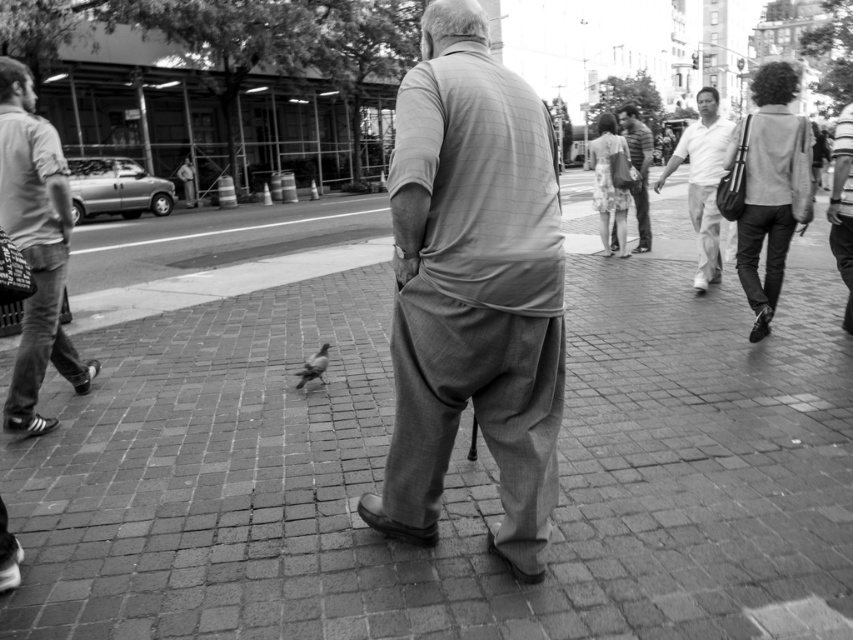
Question: Which is farther from the smooth gray pants at right?

Choices:
 (A) light gray cotton pants at center
 (B) brick pavement at center

Answer: (A)

Question: Which of the following is the closest to the observer?

Choices:
 (A) (318, 369)
 (B) (426, 188)
 (C) (32, 356)
 (D) (701, 275)

Answer: (B)

Question: Which point is farther to the camera?

Choices:
 (A) light gray cotton pants at center
 (B) white cotton shirt at upper right
 (C) light gray jeans at left

Answer: (B)

Question: Is the position of white cotton shirt at upper right less distant than that of striped cotton shirt at center?

Choices:
 (A) yes
 (B) no

Answer: (A)

Question: Does smooth gray pants at right have a lesser width compared to striped cotton shirt at center?

Choices:
 (A) no
 (B) yes

Answer: (A)

Question: Is light gray cotton pants at center smaller than striped cotton shirt at center?

Choices:
 (A) yes
 (B) no

Answer: (A)